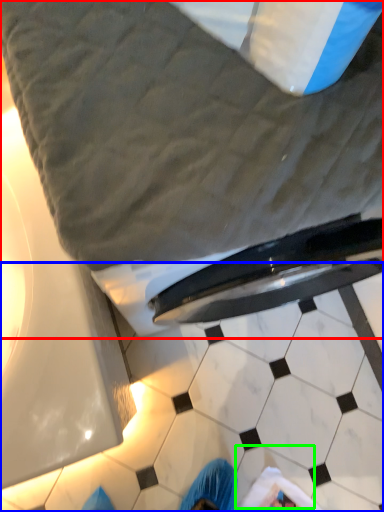
Question: Which object is the farthest from bed (highlighted by a red box)? Choose among these: tile (highlighted by a blue box) or tile (highlighted by a green box).

Choices:
 (A) tile
 (B) tile

Answer: (B)